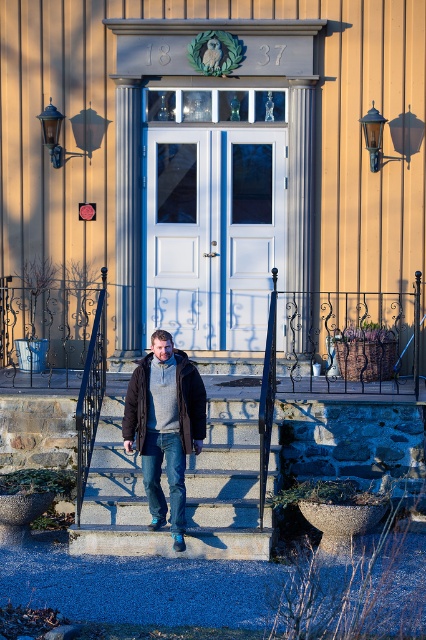
Is concrete stairs at center wider than dark gray woolen sweater at center?

Correct, the width of concrete stairs at center exceeds that of dark gray woolen sweater at center.

Is concrete stairs at center behind dark gray woolen sweater at center?

Yes, it is.

Does point (198, 541) come closer to viewer compared to point (181, 364)?

Yes.

Locate an element on the screen. This screenshot has width=426, height=640. concrete stairs at center is located at coordinates (227, 486).

Which is in front, point (163, 380) or point (144, 372)?

Point (163, 380) is more forward.

This screenshot has width=426, height=640. What do you see at coordinates (164, 426) in the screenshot?
I see `dark gray woolen sweater at center` at bounding box center [164, 426].

Find the location of a particular element. The width and height of the screenshot is (426, 640). dark gray woolen sweater at center is located at coordinates (164, 426).

How distant is smooth concrete steps at center from black metal railing at lower left?

They are 2.20 meters apart.

Which is more to the right, smooth concrete steps at center or black metal railing at lower left?

smooth concrete steps at center is more to the right.

What are the coordinates of `smooth concrete steps at center` in the screenshot? It's located at (348, 340).